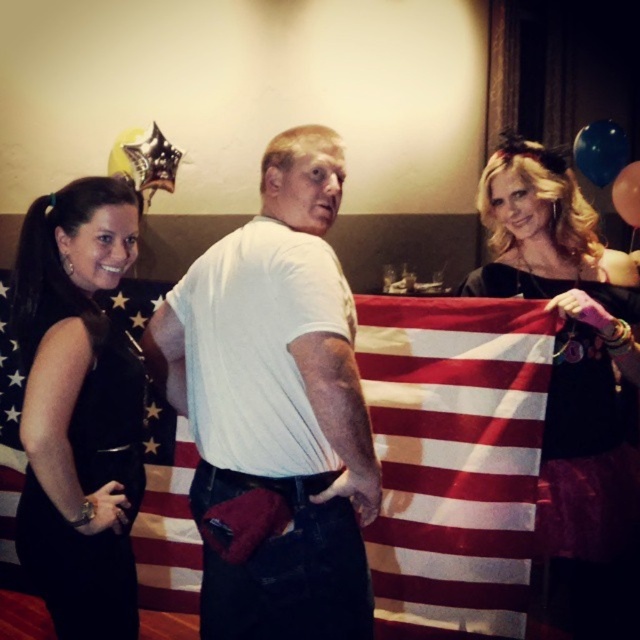
Who is more forward, (42, 272) or (605, 138)?

Point (42, 272)

Which is more to the right, black dress at left or blue glossy balloon at upper right?

Positioned to the right is blue glossy balloon at upper right.

Between point (131, 518) and point (628, 147), which one is positioned in front?

Positioned in front is point (131, 518).

The height and width of the screenshot is (640, 640). What are the coordinates of `black dress at left` in the screenshot? It's located at (80, 408).

Is black dress at left above rubber balloon at upper right?

No.

Who is positioned more to the right, black dress at left or rubber balloon at upper right?

Positioned to the right is rubber balloon at upper right.

At what (x,y) coordinates should I click in order to perform the action: click on black dress at left. Please return your answer as a coordinate pair (x, y). Looking at the image, I should click on (80, 408).

Does white matte t-shirt at center have a larger size compared to blue glossy balloon at upper right?

Yes.

Who is positioned more to the left, white matte t-shirt at center or blue glossy balloon at upper right?

white matte t-shirt at center

The height and width of the screenshot is (640, 640). What do you see at coordinates (275, 410) in the screenshot?
I see `white matte t-shirt at center` at bounding box center [275, 410].

What are the coordinates of `white matte t-shirt at center` in the screenshot? It's located at (275, 410).